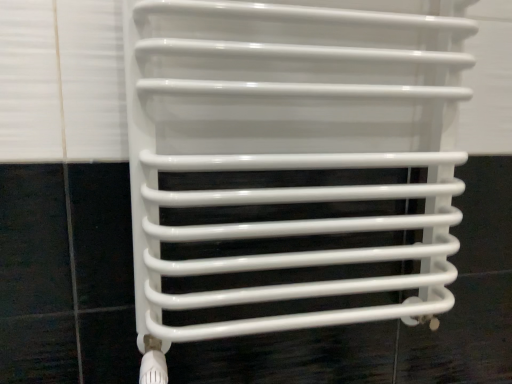
Describe the element at coordinates (289, 165) in the screenshot. I see `white glossy towel rack at center` at that location.

Image resolution: width=512 pixels, height=384 pixels. Identify the location of white glossy towel rack at center. (289, 165).

The height and width of the screenshot is (384, 512). I want to click on white glossy towel rack at center, so click(x=289, y=165).